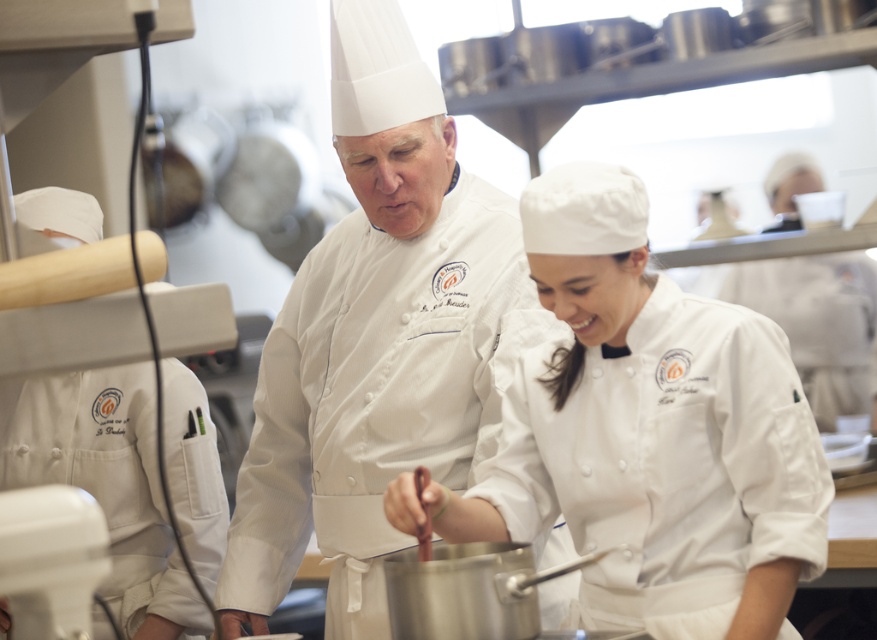
Between point (667, 289) and point (419, 552), which one is positioned behind?

Positioned behind is point (667, 289).

Can you confirm if white matte chef coat at center is positioned below wooden spoon at center?

No.

What do you see at coordinates (650, 433) in the screenshot? I see `white matte chef coat at center` at bounding box center [650, 433].

Locate an element on the screen. white matte chef coat at center is located at coordinates (650, 433).

From the picture: Can you confirm if white matte chef coat at center is positioned below white matte uniform at center?

Indeed, white matte chef coat at center is positioned under white matte uniform at center.

Which of these two, white matte chef coat at center or white matte uniform at center, stands taller?

Standing taller between the two is white matte uniform at center.

What are the coordinates of `white matte chef coat at center` in the screenshot? It's located at (650, 433).

Is point (444, 397) positioned in front of point (424, 515)?

No, (444, 397) is further to viewer.

Can you confirm if white matte uniform at center is bigger than wooden spoon at center?

Correct, white matte uniform at center is larger in size than wooden spoon at center.

Find the location of a particular element. The height and width of the screenshot is (640, 877). white matte uniform at center is located at coordinates (376, 339).